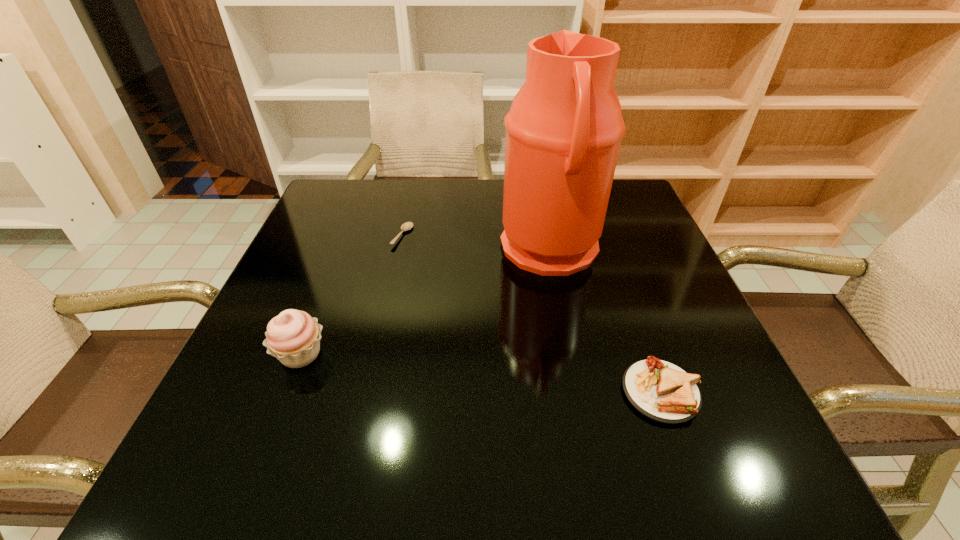
What are the coordinates of `unoccupied position between the second tallest object and the tallest object` in the screenshot? It's located at (425, 302).

Find the location of a particular element. This screenshot has height=540, width=960. empty location between the soupspoon and the second shortest object is located at coordinates (532, 314).

Where is `vacant space that's between the shortest object and the tallest object`? vacant space that's between the shortest object and the tallest object is located at coordinates (476, 243).

You are a GUI agent. You are given a task and a screenshot of the screen. Output one action in this format:
    pyautogui.click(x=<x>, y=<y>)
    Task: Click on the vacant area that lies between the second object from left to right and the third shortest object
    
    Given the screenshot: What is the action you would take?
    pyautogui.click(x=351, y=295)

Identify the location of free space between the tallest object and the leftmost object. (425, 302).

Point out which object is positioned as the nearest to the shortest object. Please provide its 2D coordinates. Your answer should be formatted as a tuple, i.e. [(x, y)], where the tuple contains the x and y coordinates of a point satisfying the conditions above.

[(563, 132)]

Choose which object is the nearest neighbor to the tallest object. Please provide its 2D coordinates. Your answer should be formatted as a tuple, i.e. [(x, y)], where the tuple contains the x and y coordinates of a point satisfying the conditions above.

[(660, 390)]

The image size is (960, 540). I want to click on vacant area in the image that satisfies the following two spatial constraints: 1. from the spout of the water jug; 2. on the back side of the sandwich, so click(x=578, y=392).

The width and height of the screenshot is (960, 540). What are the coordinates of `free region that satisfies the following two spatial constraints: 1. from the spout of the tallest object; 2. on the left side of the sandwich` in the screenshot? It's located at (578, 392).

Locate an element on the screen. The width and height of the screenshot is (960, 540). free location that satisfies the following two spatial constraints: 1. on the back side of the soupspoon; 2. on the left side of the leftmost object is located at coordinates (347, 235).